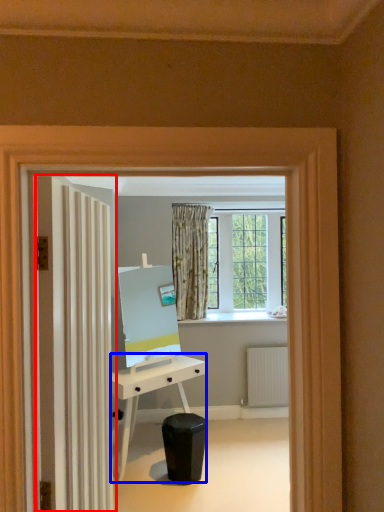
Question: Which of the following is the farthest to the observer, door (highlighted by a red box) or desk (highlighted by a blue box)?

Choices:
 (A) door
 (B) desk

Answer: (B)